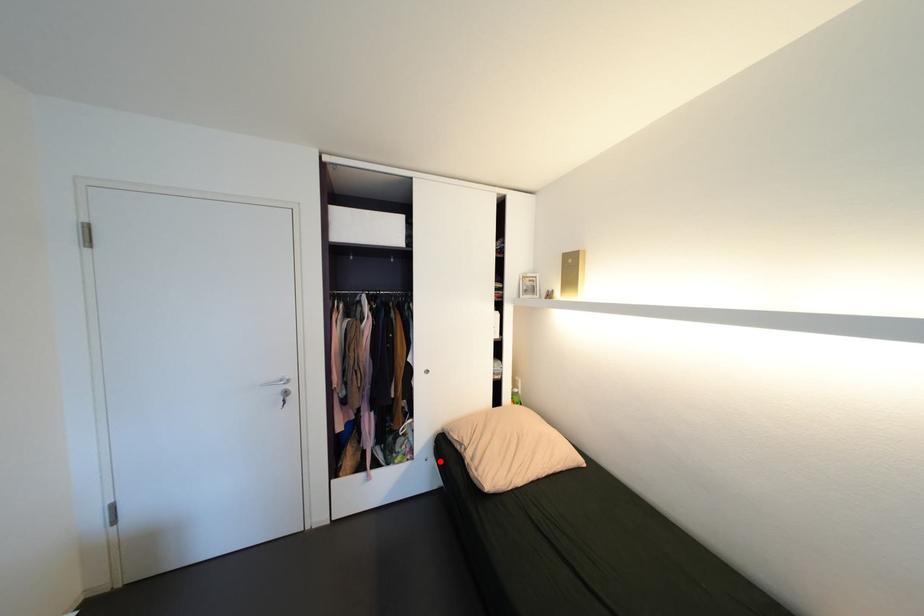
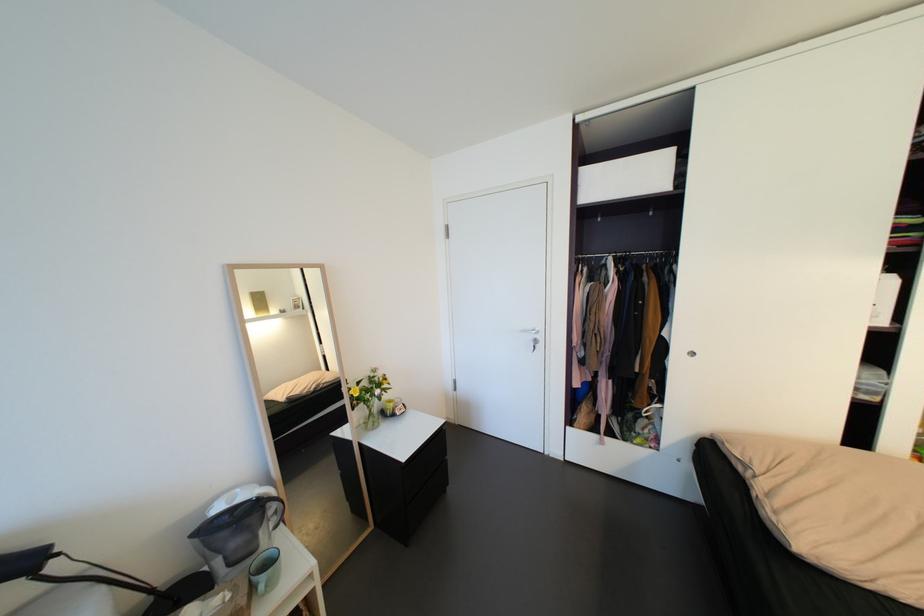
Question: I am providing you with two images of the same scene from different viewpoints. A red point is shown in image1. For the corresponding object point in image2, is it positioned nearer or farther from the camera?

Choices:
 (A) Nearer
 (B) Farther

Answer: (A)